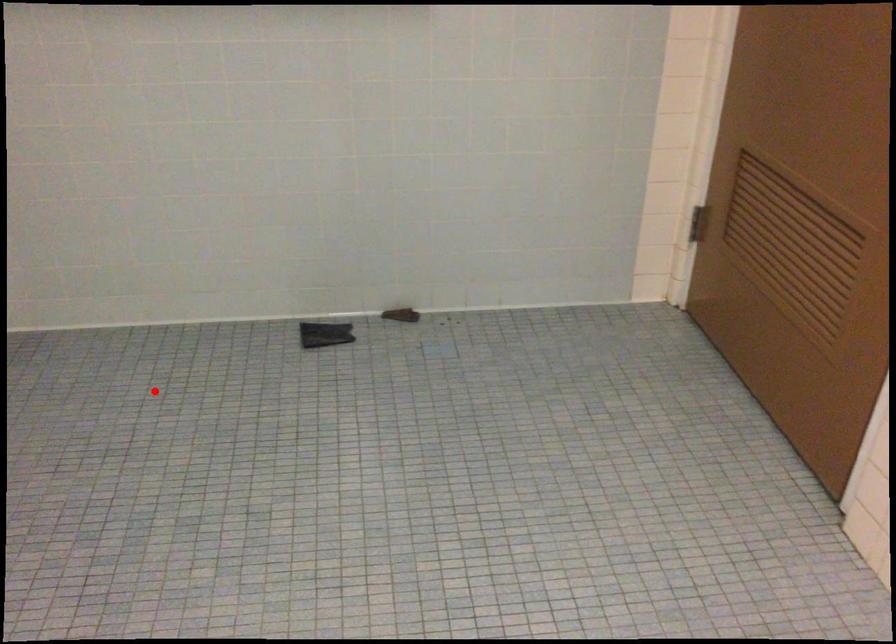
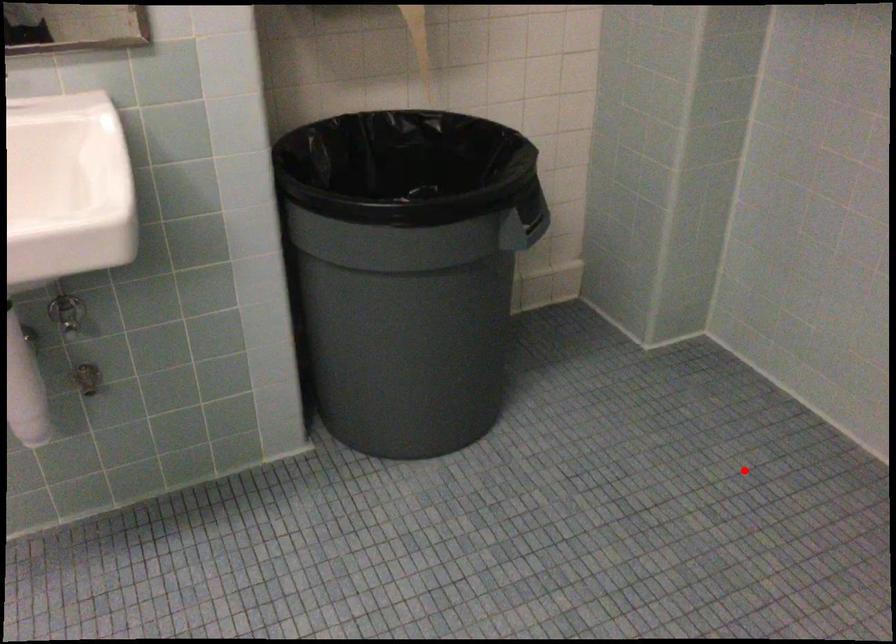
I am providing you with two images of the same scene from different viewpoints. A red point is marked on the first image and another point is marked on the second image. Is the red point in image1 aligned with the point shown in image2?

Yes